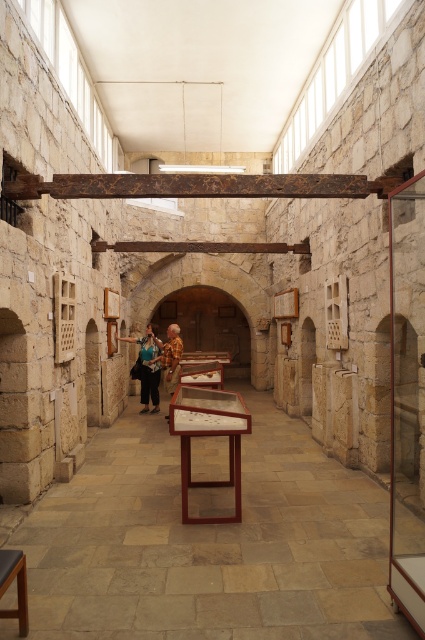
Question: Where is wooden display case at center located in relation to smooth wooden stool at lower left in the image?

Choices:
 (A) left
 (B) right

Answer: (B)

Question: Does wooden display case at center appear on the left side of smooth wooden stool at lower left?

Choices:
 (A) yes
 (B) no

Answer: (B)

Question: Considering the relative positions of blue denim jeans at center and smooth wooden stool at lower left in the image provided, where is blue denim jeans at center located with respect to smooth wooden stool at lower left?

Choices:
 (A) left
 (B) right

Answer: (A)

Question: Estimate the real-world distances between objects in this image. Which object is farther from the wooden display case at center?

Choices:
 (A) blue denim jeans at center
 (B) smooth wooden stool at lower left

Answer: (A)

Question: Among these points, which one is nearest to the camera?

Choices:
 (A) (164, 376)
 (B) (25, 614)
 (C) (178, 497)
 (D) (141, 372)

Answer: (B)

Question: Which object is positioned farthest from the blue denim jeans at center?

Choices:
 (A) wooden display case at center
 (B) smooth wooden stool at lower left
 (C) golden textured statue at center

Answer: (B)